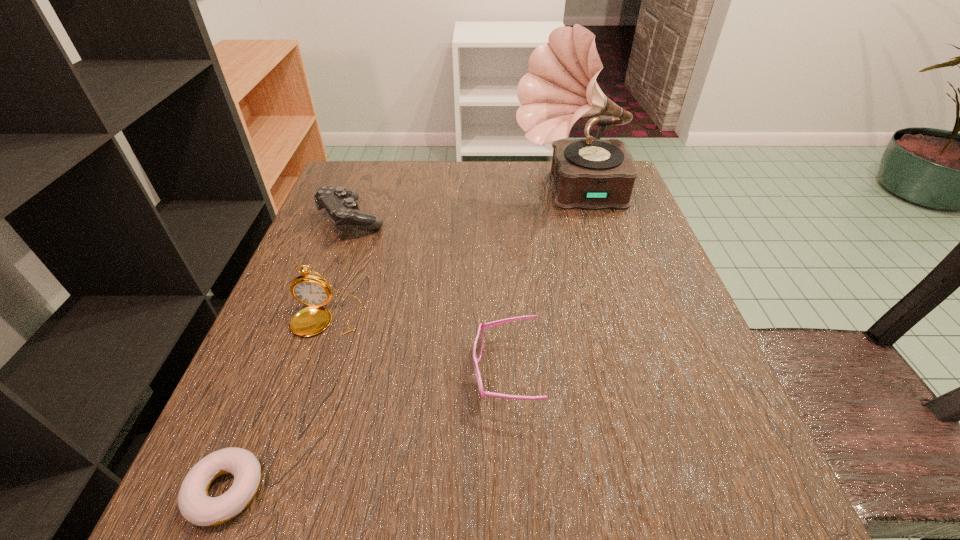
The image size is (960, 540). Find the location of `record player`. record player is located at coordinates (561, 87).

Identify the location of the fourth shortest object. Image resolution: width=960 pixels, height=540 pixels. click(x=311, y=290).

The image size is (960, 540). What are the coordinates of `the third tallest object` in the screenshot? It's located at (341, 203).

What are the coordinates of `the second shortest object` in the screenshot? It's located at (478, 345).

Where is `doughnut`? This screenshot has height=540, width=960. doughnut is located at coordinates (195, 505).

In order to click on the nearest object in this screenshot , I will do `click(195, 505)`.

Find the location of `free space located from the horn of the record player`. free space located from the horn of the record player is located at coordinates (420, 193).

At what (x,y) coordinates should I click in order to perform the action: click on free space located 0.110m from the horn of the record player. Please return your answer as a coordinate pair (x, y). This screenshot has width=960, height=540. Looking at the image, I should click on (467, 193).

What are the coordinates of `free space located 0.090m from the horn of the record player` in the screenshot? It's located at (475, 193).

Locate an element on the screen. vacant space located on the face of the second tallest object is located at coordinates (298, 402).